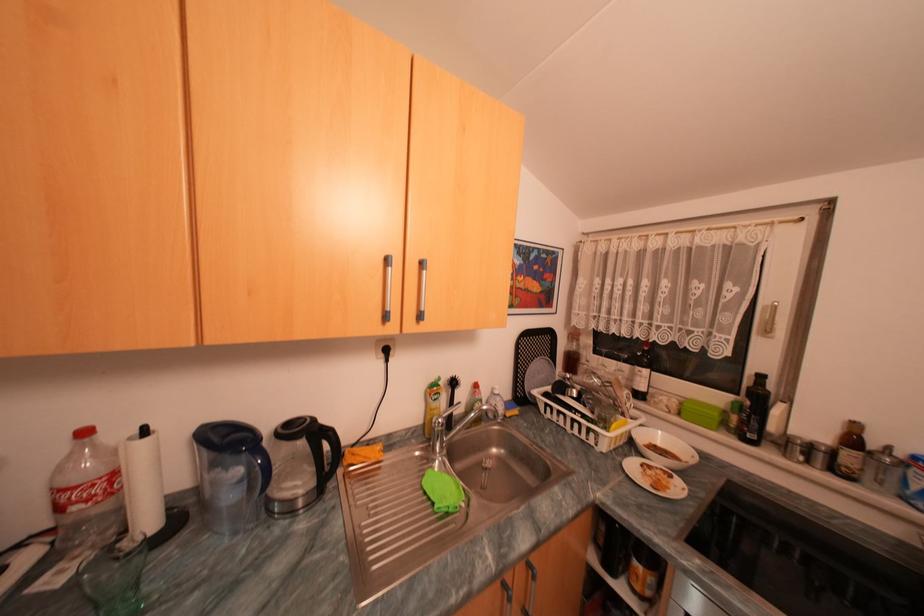
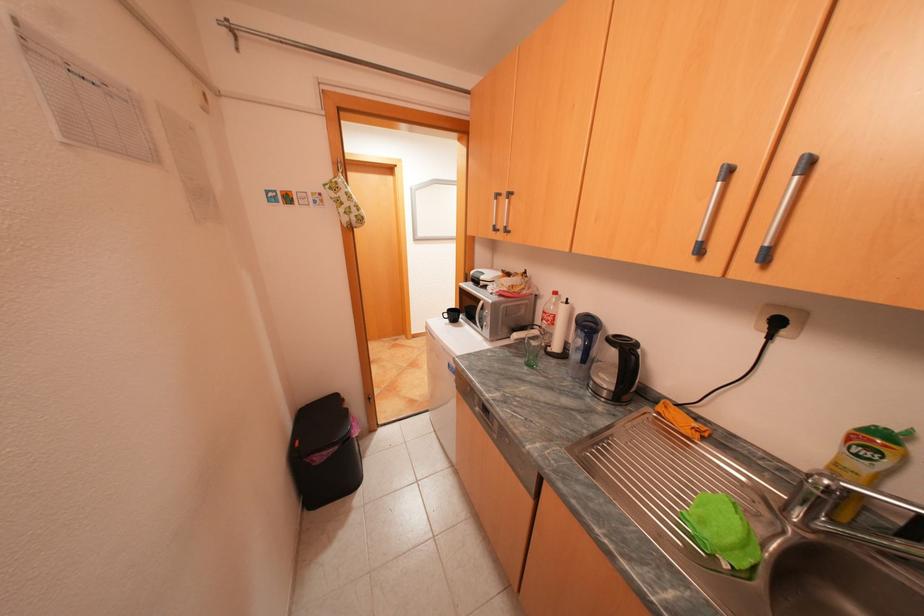
The point at (396,350) is marked in the first image. Where is the corresponding point in the second image?

(786, 323)